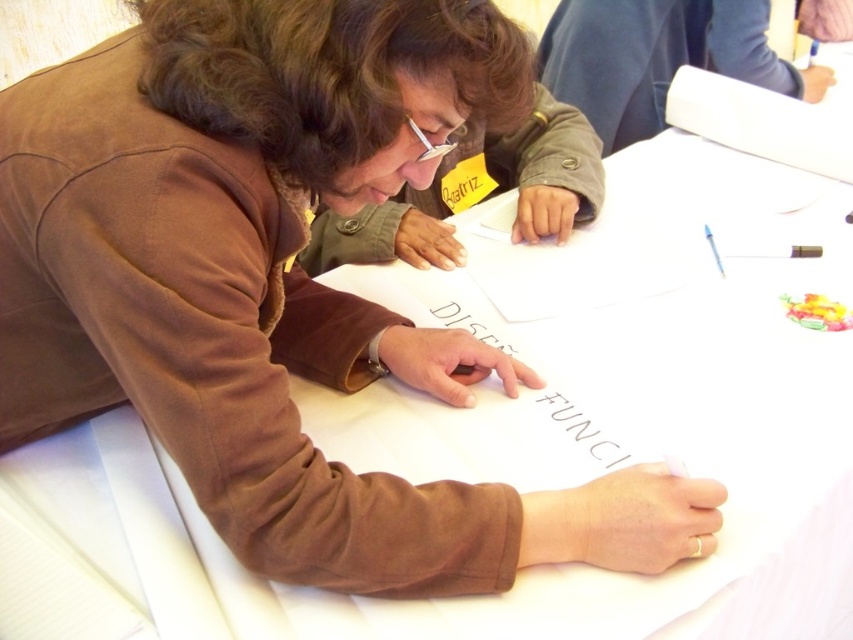
Is point (734, 8) closer to camera compared to point (457, 305)?

No.

Is point (662, 48) positioned before point (550, 472)?

No, (662, 48) is behind (550, 472).

At what (x,y) coordinates should I click in order to perform the action: click on blue fabric at upper center. Please return your answer as a coordinate pair (x, y). The height and width of the screenshot is (640, 853). Looking at the image, I should click on (657, 58).